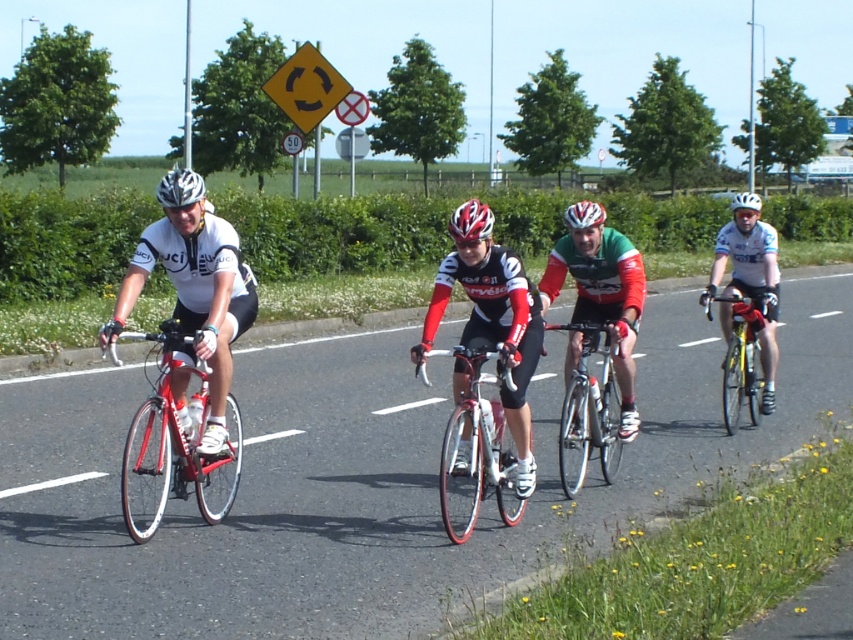
In the scene shown: Between shiny red bicycle at left and yellow plastic diamond at upper center, which one has less height?

With less height is shiny red bicycle at left.

Who is lower down, shiny red bicycle at left or yellow plastic diamond at upper center?

shiny red bicycle at left

This screenshot has width=853, height=640. What are the coordinates of `shiny red bicycle at left` in the screenshot? It's located at (171, 451).

Image resolution: width=853 pixels, height=640 pixels. What are the coordinates of `shiny red bicycle at left` in the screenshot? It's located at (171, 451).

Who is more distant from viewer, (724, 400) or (276, 99)?

The point (276, 99) is behind.

Can you confirm if yellow metallic bicycle at right is thinner than yellow plastic diamond at upper center?

Yes.

Describe the element at coordinates (741, 353) in the screenshot. This screenshot has height=640, width=853. I see `yellow metallic bicycle at right` at that location.

This screenshot has width=853, height=640. Find the location of `yellow metallic bicycle at right`. yellow metallic bicycle at right is located at coordinates (741, 353).

Does white matte bicycle helmet at left lie in front of white glossy bicycle helmet at center?

Yes.

Consider the image. Does white matte bicycle helmet at left have a greater width compared to white glossy bicycle helmet at center?

Yes.

This screenshot has height=640, width=853. I want to click on white matte bicycle helmet at left, so click(x=178, y=188).